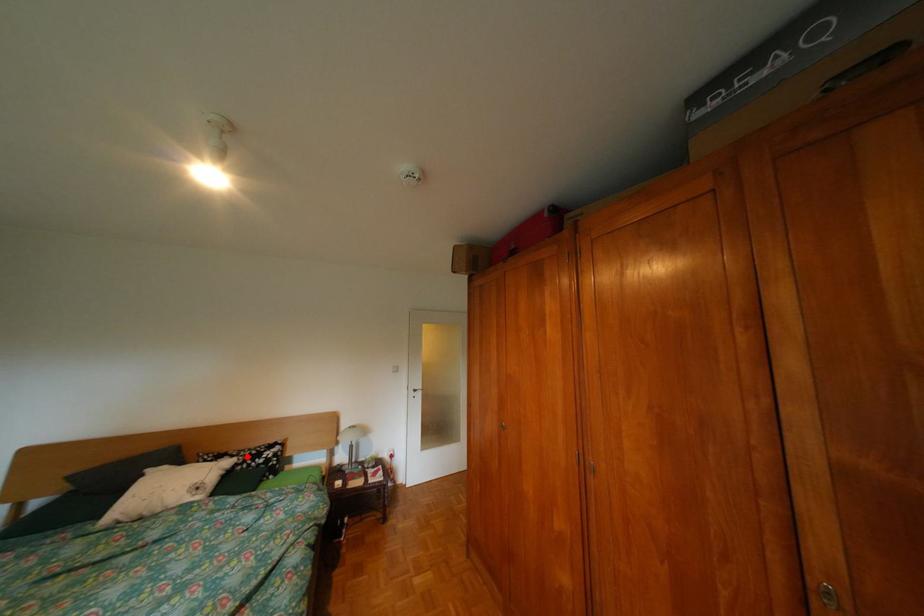
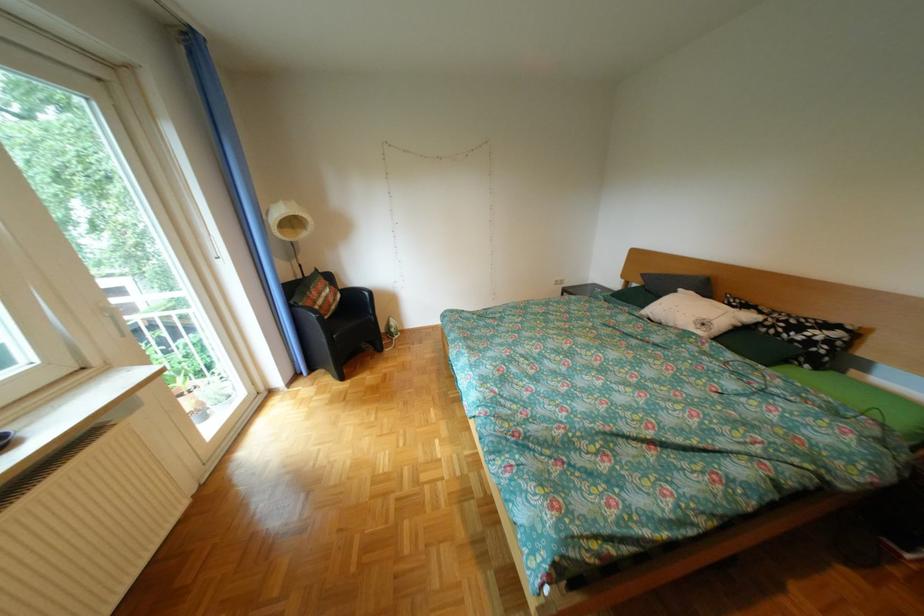
In the second image, find the point that corresponds to the highlighted location in the first image.

(775, 313)